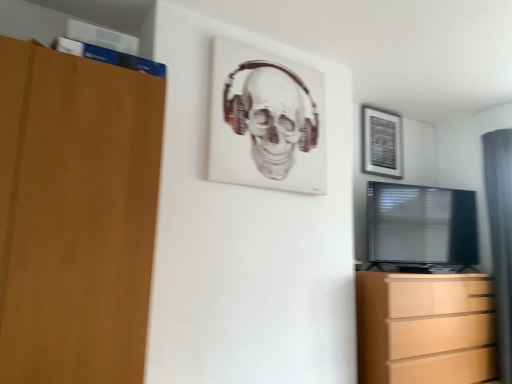
Question: Is gray fabric curtain at right with matte black picture frame at upper right, arranged as the second picture frame when viewed from the left?

Choices:
 (A) yes
 (B) no

Answer: (B)

Question: Does gray fabric curtain at right appear on the right side of matte black picture frame at upper right, the first picture frame viewed from the back?

Choices:
 (A) yes
 (B) no

Answer: (A)

Question: From a real-world perspective, is gray fabric curtain at right under matte black picture frame at upper right, arranged as the second picture frame when viewed from the left?

Choices:
 (A) yes
 (B) no

Answer: (A)

Question: From a real-world perspective, does gray fabric curtain at right stand above matte black picture frame at upper right, the first picture frame viewed from the back?

Choices:
 (A) yes
 (B) no

Answer: (B)

Question: Does gray fabric curtain at right have a lesser height compared to matte black picture frame at upper right, arranged as the second picture frame when viewed from the front?

Choices:
 (A) no
 (B) yes

Answer: (A)

Question: Considering the positions of gray fabric curtain at right and light brown wooden chest of drawers at lower right in the image, is gray fabric curtain at right taller or shorter than light brown wooden chest of drawers at lower right?

Choices:
 (A) tall
 (B) short

Answer: (A)

Question: From a real-world perspective, is gray fabric curtain at right positioned above or below light brown wooden chest of drawers at lower right?

Choices:
 (A) above
 (B) below

Answer: (A)

Question: Relative to light brown wooden chest of drawers at lower right, is gray fabric curtain at right in front or behind?

Choices:
 (A) behind
 (B) front

Answer: (A)

Question: Would you say gray fabric curtain at right is inside or outside light brown wooden chest of drawers at lower right?

Choices:
 (A) inside
 (B) outside

Answer: (B)

Question: From a real-world perspective, is black glossy tv at right above or below gray fabric curtain at right?

Choices:
 (A) above
 (B) below

Answer: (A)

Question: From the image's perspective, relative to gray fabric curtain at right, is black glossy tv at right above or below?

Choices:
 (A) below
 (B) above

Answer: (B)

Question: Visually, is black glossy tv at right positioned to the left or to the right of gray fabric curtain at right?

Choices:
 (A) left
 (B) right

Answer: (A)

Question: Does point (436, 190) appear closer or farther from the camera than point (499, 142)?

Choices:
 (A) farther
 (B) closer

Answer: (A)

Question: Is matte black picture frame at upper right, arranged as the second picture frame when viewed from the left, taller or shorter than white matte picture frame at upper center, which ranks as the 2th picture frame in right-to-left order?

Choices:
 (A) short
 (B) tall

Answer: (A)

Question: Is point pyautogui.click(x=376, y=119) closer or farther from the camera than point pyautogui.click(x=232, y=125)?

Choices:
 (A) farther
 (B) closer

Answer: (A)